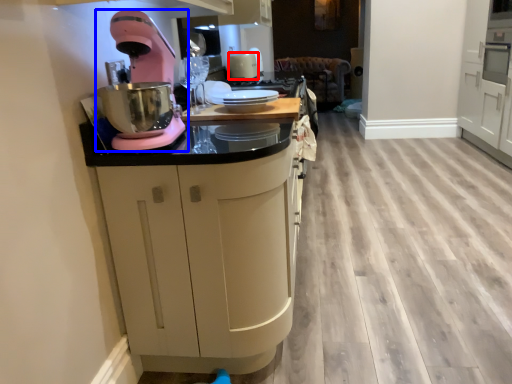
Question: Among these objects, which one is nearest to the camera, kitchen appliance (highlighted by a red box) or home appliance (highlighted by a blue box)?

Choices:
 (A) kitchen appliance
 (B) home appliance

Answer: (B)